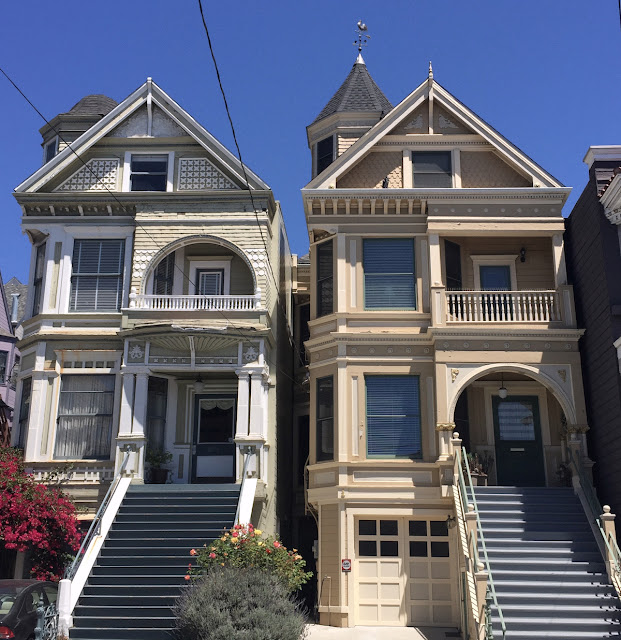
This screenshot has height=640, width=621. What are the coordinates of `front door` in the screenshot? It's located at (526, 456).